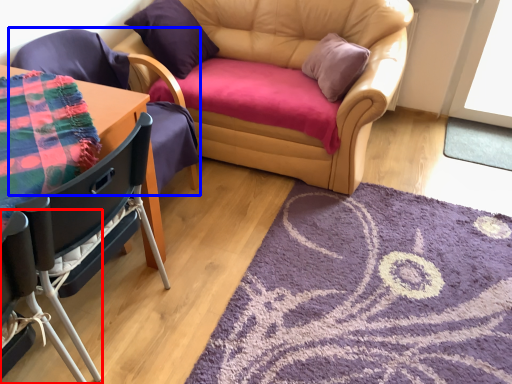
Question: Which point is further to the camera, chair (highlighted by a red box) or chair (highlighted by a blue box)?

Choices:
 (A) chair
 (B) chair

Answer: (B)